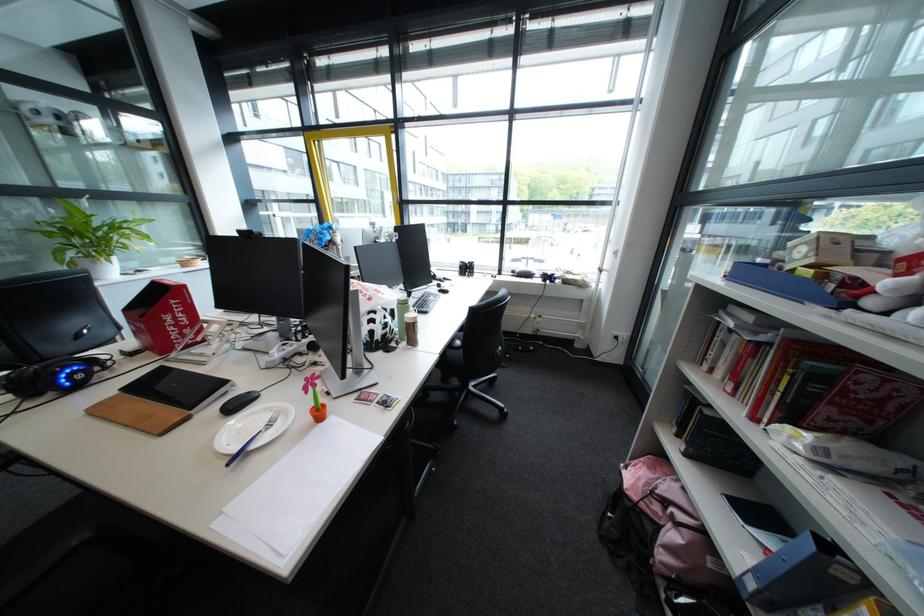
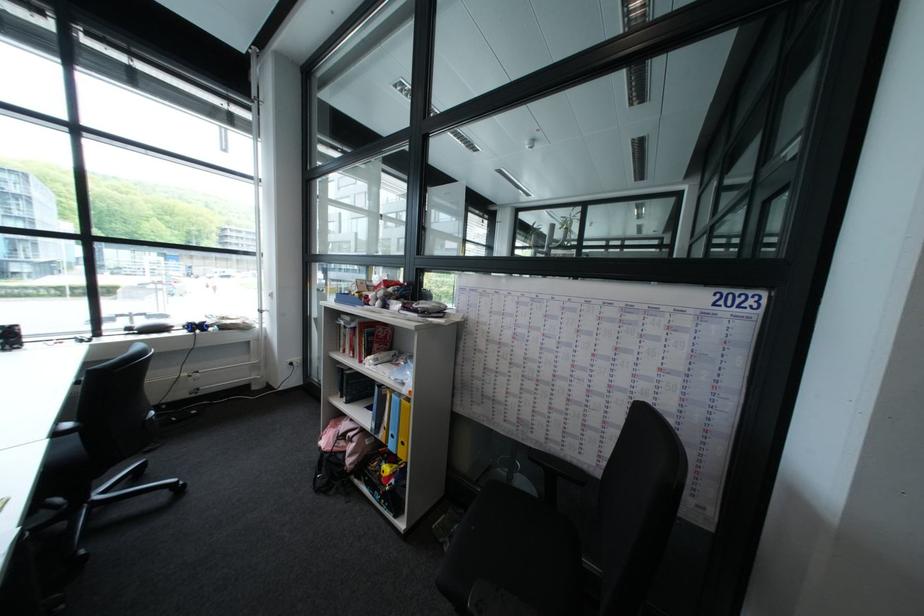
Locate, in the second image, the point that corresponds to pixel 558 273 in the first image.

(203, 322)